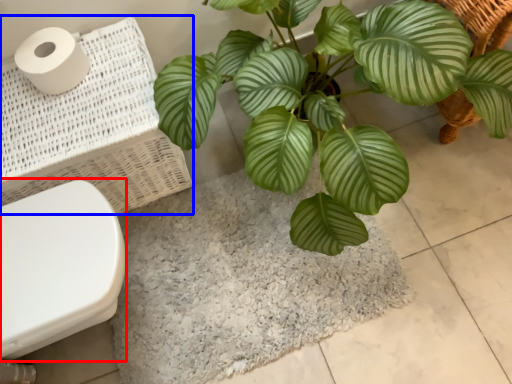
Question: Among these objects, which one is farthest to the camera, toilet bowl (highlighted by a red box) or laundry basket (highlighted by a blue box)?

Choices:
 (A) toilet bowl
 (B) laundry basket

Answer: (B)